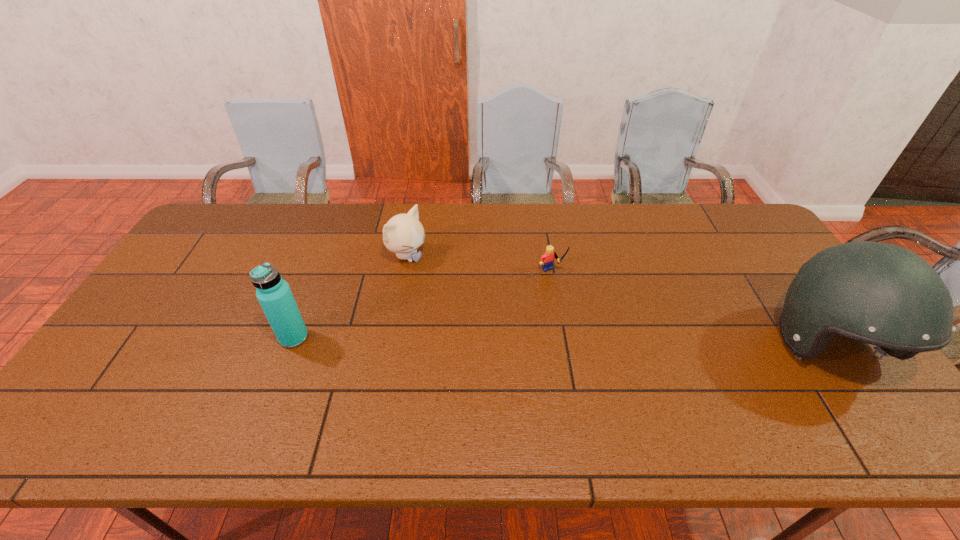
Image resolution: width=960 pixels, height=540 pixels. I want to click on vacant spot on the desktop that is between the leftmost object and the football helmet and is positioned on the front-facing side of the Lego, so pyautogui.click(x=610, y=343).

Identify the location of free space on the desktop that is between the leftmost object and the rightmost object and is positioned on the face of the third object from right to left. The height and width of the screenshot is (540, 960). (558, 342).